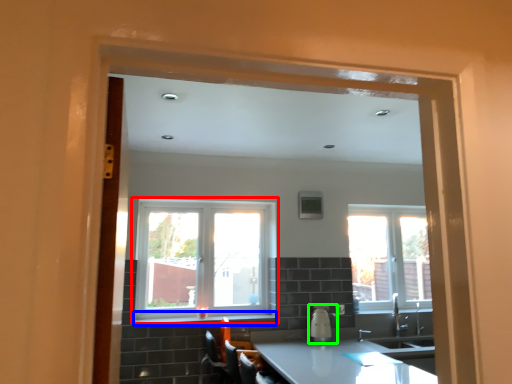
Question: Based on their relative distances, which object is farther from window (highlighted by a red box)? Choose from window sill (highlighted by a blue box) and appliance (highlighted by a green box).

Choices:
 (A) window sill
 (B) appliance

Answer: (B)